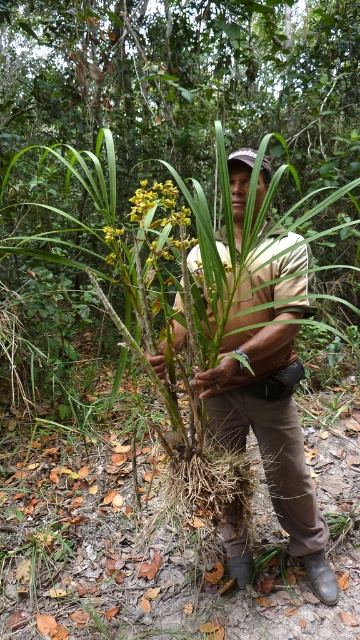
You are a botanist examining the image of the man with the plant. You need to determine which of the two points, point (307, 262) or point (178, 244), is closer to the camera. Which point is closer?

Point (307, 262) is further to the viewer than point (178, 244), so the closer point to the camera is point (178, 244).

You are a researcher analyzing the spatial coordinates of objects in the image. The researcher wants to know if the brown leather boots at lower center are located closer to the top or bottom of the image. Based on the coordinates provided, can you determine this?

The coordinates of the brown leather boots at lower center are at point 0.680 on the x axis and 0.753 on the y axis. Since the y coordinate is closer to 1, which typically represents the bottom of the image in coordinate systems, the brown leather boots at lower center are closer to the bottom of the image.